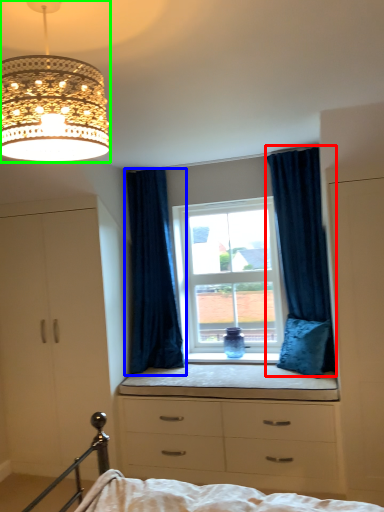
Question: Considering the real-world distances, which object is farthest from curtain (highlighted by a red box)? curtain (highlighted by a blue box) or lamp (highlighted by a green box)?

Choices:
 (A) curtain
 (B) lamp

Answer: (B)